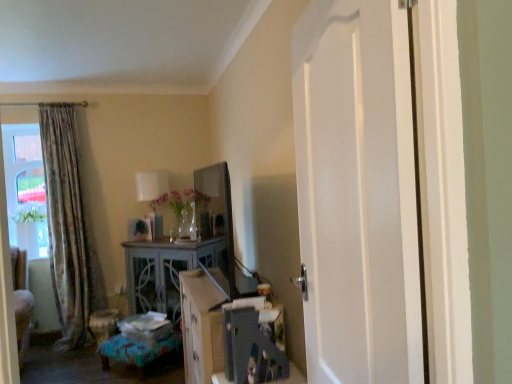
Question: From the image's perspective, would you say floral fabric curtain at left is shown under white fabric lampshade at upper center?

Choices:
 (A) yes
 (B) no

Answer: (A)

Question: Considering the relative sizes of floral fabric curtain at left and white fabric lampshade at upper center in the image provided, is floral fabric curtain at left thinner than white fabric lampshade at upper center?

Choices:
 (A) no
 (B) yes

Answer: (A)

Question: From a real-world perspective, is floral fabric curtain at left beneath white fabric lampshade at upper center?

Choices:
 (A) yes
 (B) no

Answer: (A)

Question: Does floral fabric curtain at left lie in front of white fabric lampshade at upper center?

Choices:
 (A) no
 (B) yes

Answer: (B)

Question: Is floral fabric curtain at left oriented towards white fabric lampshade at upper center?

Choices:
 (A) no
 (B) yes

Answer: (A)

Question: Relative to floral fabric curtain at left, is textured blue fabric ottoman at lower center in front or behind?

Choices:
 (A) front
 (B) behind

Answer: (A)

Question: From the image's perspective, is textured blue fabric ottoman at lower center positioned above or below floral fabric curtain at left?

Choices:
 (A) below
 (B) above

Answer: (A)

Question: In terms of height, does textured blue fabric ottoman at lower center look taller or shorter compared to floral fabric curtain at left?

Choices:
 (A) tall
 (B) short

Answer: (B)

Question: From a real-world perspective, is textured blue fabric ottoman at lower center above or below floral fabric curtain at left?

Choices:
 (A) below
 (B) above

Answer: (A)

Question: Considering the positions of point (392, 155) and point (157, 175), is point (392, 155) closer or farther from the camera than point (157, 175)?

Choices:
 (A) closer
 (B) farther

Answer: (A)

Question: From the image's perspective, relative to white fabric lampshade at upper center, is white smooth door at center above or below?

Choices:
 (A) below
 (B) above

Answer: (B)

Question: Considering the positions of white smooth door at center and white fabric lampshade at upper center in the image, is white smooth door at center wider or thinner than white fabric lampshade at upper center?

Choices:
 (A) thin
 (B) wide

Answer: (A)

Question: From a real-world perspective, is white smooth door at center above or below white fabric lampshade at upper center?

Choices:
 (A) above
 (B) below

Answer: (A)

Question: Is white fabric lampshade at upper center spatially inside distressed wood cabinet at center, or outside of it?

Choices:
 (A) outside
 (B) inside

Answer: (A)

Question: From the image's perspective, is white fabric lampshade at upper center positioned above or below distressed wood cabinet at center?

Choices:
 (A) above
 (B) below

Answer: (A)